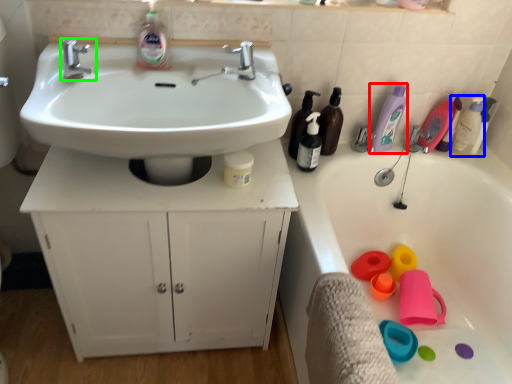
Question: Based on their relative distances, which object is farther from cleaning product (highlighted by a red box)? Choose from cleaning product (highlighted by a blue box) and tap (highlighted by a green box).

Choices:
 (A) cleaning product
 (B) tap

Answer: (B)